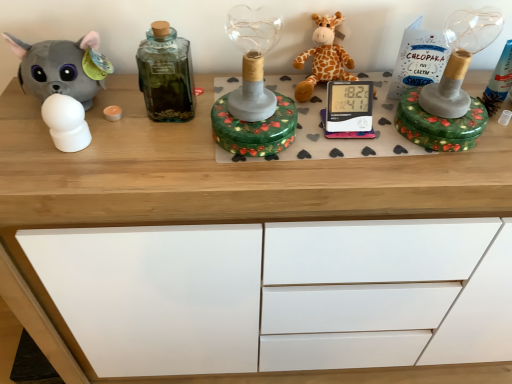
Locate an element on the screen. The image size is (512, 384). free location in front of matte gray plush toy at left, the 1th toy when ordered from left to right is located at coordinates (87, 163).